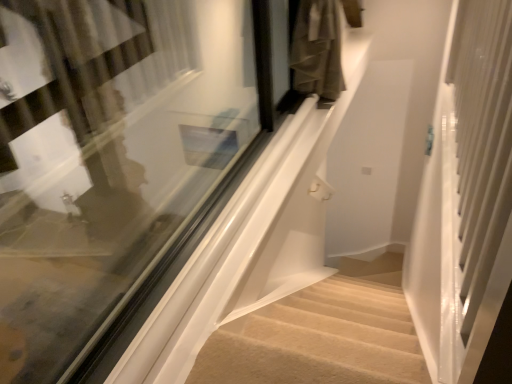
Question: Is beige carpeted stairs at lower center outside white glossy screen door at right?

Choices:
 (A) yes
 (B) no

Answer: (A)

Question: From a real-world perspective, is beige carpeted stairs at lower center over white glossy screen door at right?

Choices:
 (A) no
 (B) yes

Answer: (A)

Question: Is beige carpeted stairs at lower center to the left of white glossy screen door at right from the viewer's perspective?

Choices:
 (A) yes
 (B) no

Answer: (A)

Question: Is beige carpeted stairs at lower center thinner than white glossy screen door at right?

Choices:
 (A) no
 (B) yes

Answer: (B)

Question: Is beige carpeted stairs at lower center facing towards white glossy screen door at right?

Choices:
 (A) yes
 (B) no

Answer: (B)

Question: From a real-world perspective, is white glossy screen door at right above or below beige carpeted stairs at lower center?

Choices:
 (A) above
 (B) below

Answer: (A)

Question: Considering the relative positions of white glossy screen door at right and beige carpeted stairs at lower center in the image provided, is white glossy screen door at right to the left or to the right of beige carpeted stairs at lower center?

Choices:
 (A) left
 (B) right

Answer: (B)

Question: Looking at the image, does white glossy screen door at right seem bigger or smaller compared to beige carpeted stairs at lower center?

Choices:
 (A) big
 (B) small

Answer: (A)

Question: Looking at their shapes, would you say white glossy screen door at right is wider or thinner than beige carpeted stairs at lower center?

Choices:
 (A) wide
 (B) thin

Answer: (A)

Question: Relative to clear glass window at center, is beige carpeted stairs at lower center in front or behind?

Choices:
 (A) behind
 (B) front

Answer: (A)

Question: Does point (394, 382) appear closer or farther from the camera than point (59, 263)?

Choices:
 (A) farther
 (B) closer

Answer: (B)

Question: Is beige carpeted stairs at lower center inside or outside of clear glass window at center?

Choices:
 (A) inside
 (B) outside

Answer: (B)

Question: Considering the positions of beige carpeted stairs at lower center and clear glass window at center in the image, is beige carpeted stairs at lower center wider or thinner than clear glass window at center?

Choices:
 (A) thin
 (B) wide

Answer: (A)

Question: Choose the correct answer: Is beige carpeted stairs at lower center inside white glossy screen door at right or outside it?

Choices:
 (A) outside
 (B) inside

Answer: (A)

Question: Would you say beige carpeted stairs at lower center is to the left or to the right of white glossy screen door at right in the picture?

Choices:
 (A) right
 (B) left

Answer: (B)